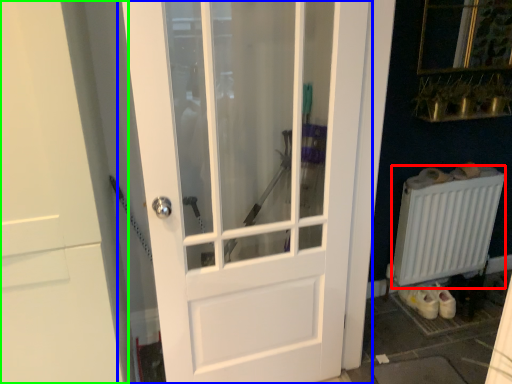
Question: Considering the real-world distances, which object is closest to radiator (highlighted by a red box)? door (highlighted by a blue box) or door (highlighted by a green box).

Choices:
 (A) door
 (B) door

Answer: (A)